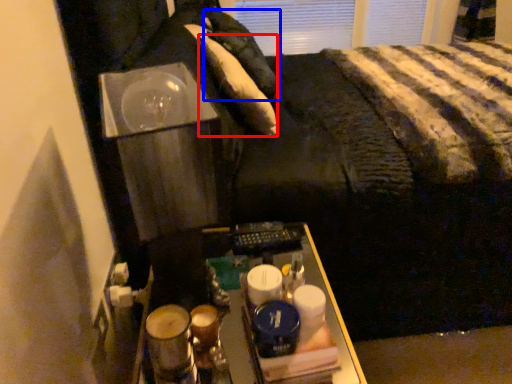
Question: Among these objects, which one is farthest to the camera, pillow (highlighted by a red box) or pillow (highlighted by a blue box)?

Choices:
 (A) pillow
 (B) pillow

Answer: (B)